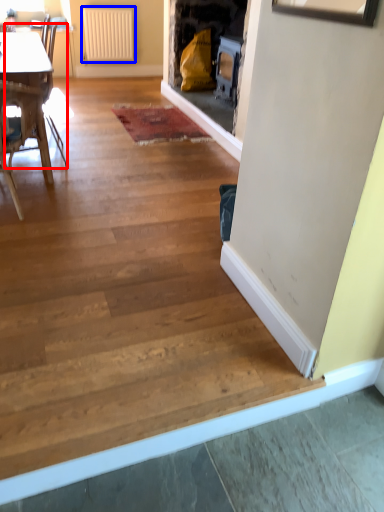
Question: Among these objects, which one is nearest to the camera, armchair (highlighted by a red box) or radiator (highlighted by a blue box)?

Choices:
 (A) armchair
 (B) radiator

Answer: (A)